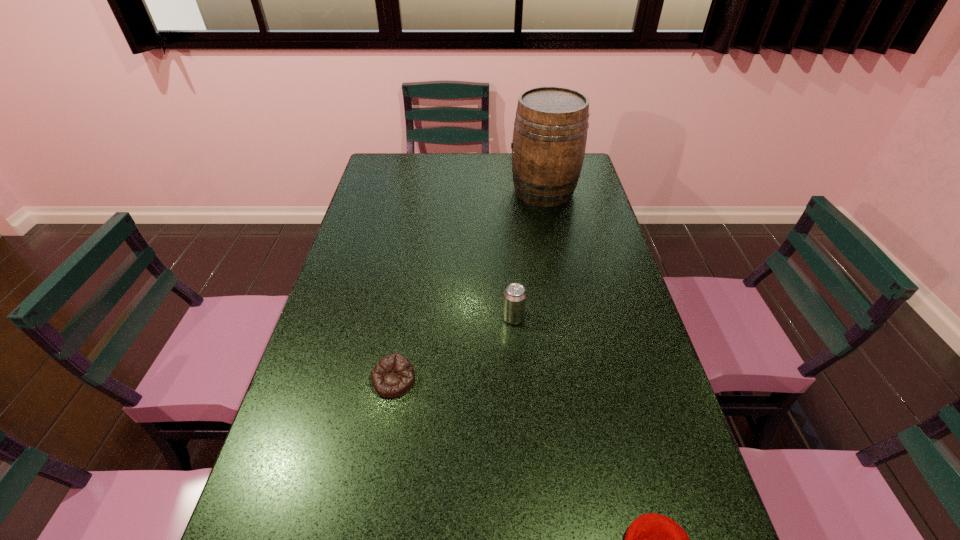
The height and width of the screenshot is (540, 960). Identify the location of the farthest object. (550, 130).

Image resolution: width=960 pixels, height=540 pixels. Identify the location of cider. (550, 130).

Where is `the second farthest object`? The width and height of the screenshot is (960, 540). the second farthest object is located at coordinates (514, 301).

What are the coordinates of `beer can` in the screenshot? It's located at (514, 301).

Where is `the leftmost object`? The width and height of the screenshot is (960, 540). the leftmost object is located at coordinates (393, 376).

Where is `the third farthest object`? The height and width of the screenshot is (540, 960). the third farthest object is located at coordinates (393, 376).

The height and width of the screenshot is (540, 960). Find the location of `free spot located on the side of the tallest object near the bung hole`. free spot located on the side of the tallest object near the bung hole is located at coordinates (472, 191).

Identify the location of vacant space located 0.290m on the side of the tallest object near the bung hole. (433, 191).

Where is `vacant space located on the side of the tallest object near the bung hole`? This screenshot has width=960, height=540. vacant space located on the side of the tallest object near the bung hole is located at coordinates (462, 191).

Locate an element on the screen. vacant space situated on the left of the second tallest object is located at coordinates (484, 318).